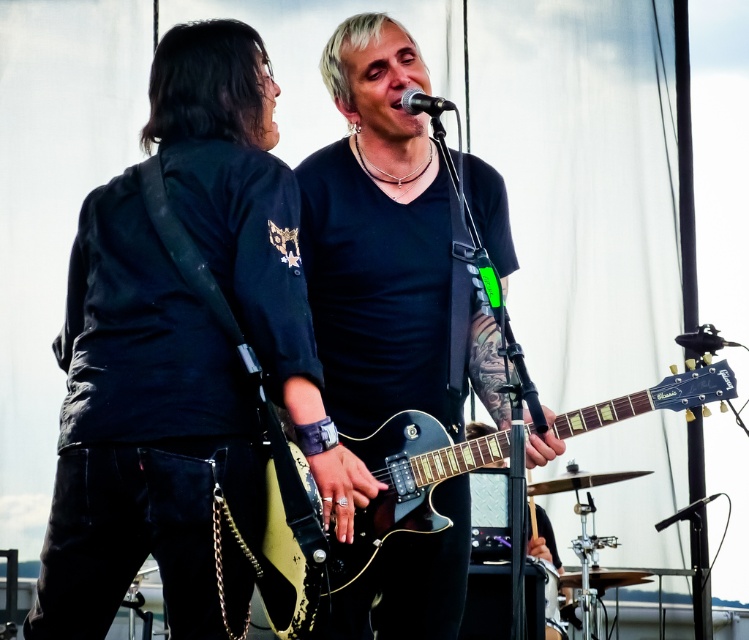
Question: Does matte black guitar at left have a greater width compared to glossy black electric guitar at center?

Choices:
 (A) no
 (B) yes

Answer: (A)

Question: Which point appears closest to the camera in this image?

Choices:
 (A) (154, 445)
 (B) (386, 56)
 (C) (667, 378)

Answer: (A)

Question: In this image, where is matte black guitar at center located relative to glossy black electric guitar at center?

Choices:
 (A) left
 (B) right

Answer: (A)

Question: Among these points, which one is nearest to the camera?

Choices:
 (A) (485, 442)
 (B) (198, 536)
 (C) (457, 513)

Answer: (B)

Question: Is glossy black electric guitar at center to the right of black metallic microphone at center from the viewer's perspective?

Choices:
 (A) no
 (B) yes

Answer: (B)

Question: Which object appears closest to the camera in this image?

Choices:
 (A) matte black guitar at left
 (B) matte black guitar at center
 (C) black metallic microphone at center

Answer: (A)